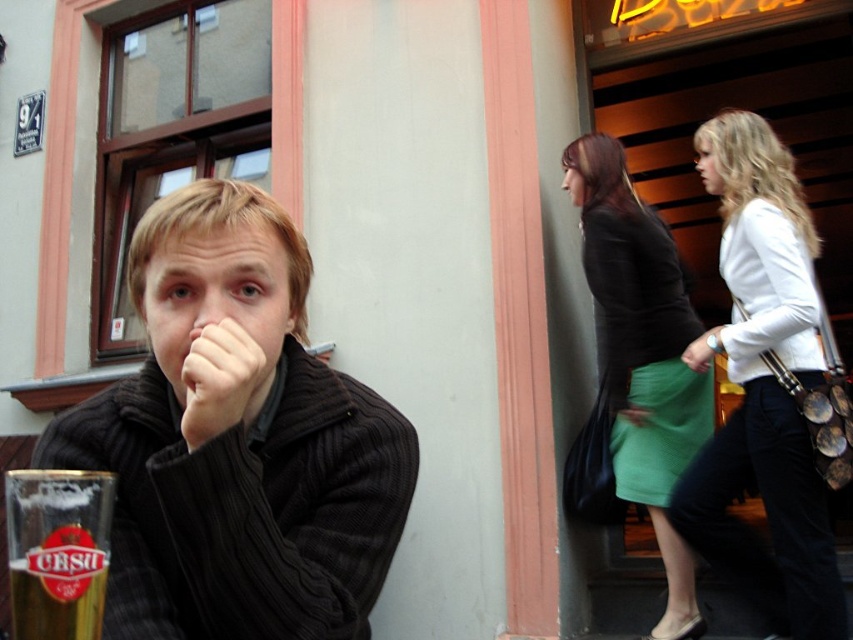
Does point (146, 294) come farther from viewer compared to point (793, 216)?

No, (146, 294) is closer to viewer.

Can you confirm if dark brown sweater at center is bigger than white leather jacket at center?

No, dark brown sweater at center is not bigger than white leather jacket at center.

Locate an element on the screen. This screenshot has width=853, height=640. dark brown sweater at center is located at coordinates (236, 442).

Who is higher up, translucent glass beer at lower left or matte brown nose at center?

matte brown nose at center is higher up.

What do you see at coordinates (57, 550) in the screenshot? Image resolution: width=853 pixels, height=640 pixels. I see `translucent glass beer at lower left` at bounding box center [57, 550].

Is point (82, 512) farther from viewer compared to point (196, 294)?

No.

Locate an element on the screen. translucent glass beer at lower left is located at coordinates (57, 550).

Who is positioned more to the left, green fabric skirt at center or translucent glass beer at lower left?

Positioned to the left is translucent glass beer at lower left.

Who is more distant from viewer, (601, 284) or (16, 490)?

The point (601, 284) is more distant.

I want to click on green fabric skirt at center, so click(x=642, y=355).

The image size is (853, 640). Find the location of `green fabric skirt at center`. green fabric skirt at center is located at coordinates (642, 355).